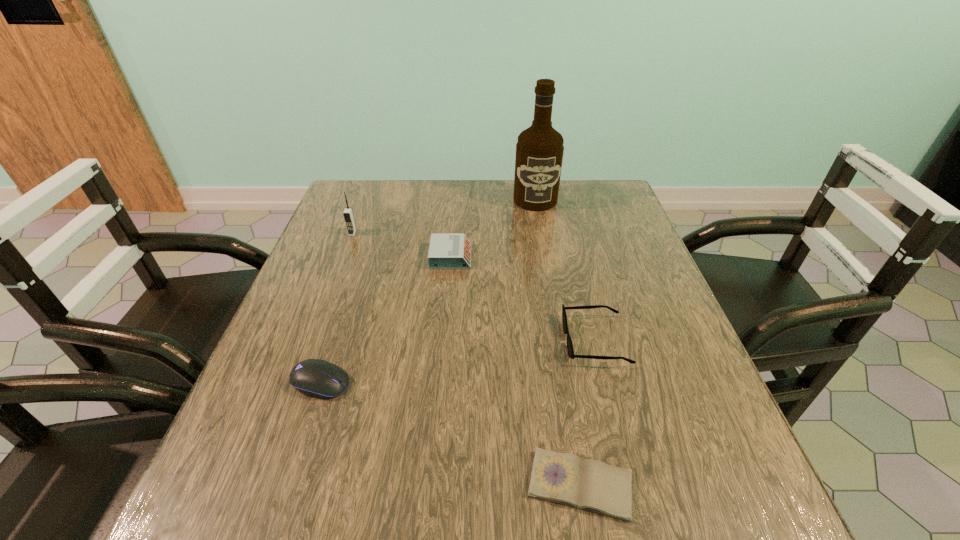
Image resolution: width=960 pixels, height=540 pixels. I want to click on cellular telephone at the left edge, so click(348, 215).

Where is `computer mouse situated at the left edge`? The height and width of the screenshot is (540, 960). computer mouse situated at the left edge is located at coordinates (318, 378).

What are the coordinates of `object that is positioned at the right edge` in the screenshot? It's located at (570, 350).

In the image, there is a desktop. At what (x,y) coordinates should I click in order to perform the action: click on vacant space at the far edge. Please return your answer as a coordinate pair (x, y). This screenshot has height=540, width=960. Looking at the image, I should click on (483, 192).

Image resolution: width=960 pixels, height=540 pixels. I want to click on blank space at the near edge of the desktop, so click(x=509, y=539).

At what (x,y) coordinates should I click in order to perform the action: click on vacant space at the left edge of the desktop. Please return your answer as a coordinate pair (x, y). The height and width of the screenshot is (540, 960). Looking at the image, I should click on tap(371, 257).

The image size is (960, 540). Identify the location of vacant space at the right edge of the desktop. (604, 260).

Image resolution: width=960 pixels, height=540 pixels. I want to click on vacant space at the far left corner of the desktop, so click(x=362, y=212).

I want to click on free space at the near right corner of the desktop, so click(x=751, y=484).

This screenshot has height=540, width=960. Find the location of `free space between the sunglasses and the fifth nearest object`. free space between the sunglasses and the fifth nearest object is located at coordinates (474, 287).